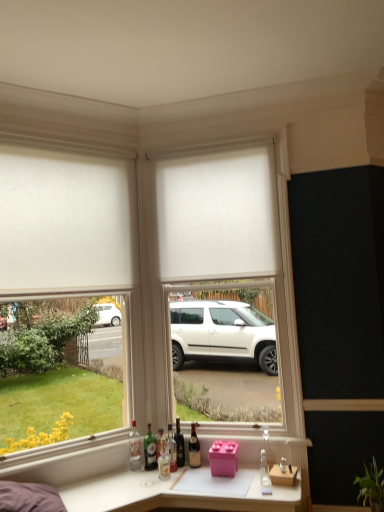
Question: Could you tell me if clear glass bottle at lower left, positioned as the seventh bottle in right-to-left order, is turned towards clear glass bottle at center, which is counted as the first bottle, starting from the right?

Choices:
 (A) yes
 (B) no

Answer: (B)

Question: Can you confirm if clear glass bottle at lower left, which is the 1th bottle from left to right, is bigger than clear glass bottle at center, which is counted as the first bottle, starting from the right?

Choices:
 (A) no
 (B) yes

Answer: (B)

Question: Is clear glass bottle at lower left, which is the 1th bottle from left to right, beside clear glass bottle at center, positioned as the seventh bottle in left-to-right order?

Choices:
 (A) yes
 (B) no

Answer: (B)

Question: Can you confirm if clear glass bottle at lower left, positioned as the seventh bottle in right-to-left order, is thinner than clear glass bottle at center, positioned as the seventh bottle in left-to-right order?

Choices:
 (A) no
 (B) yes

Answer: (A)

Question: Is clear glass bottle at lower left, which is the 1th bottle from left to right, smaller than clear glass bottle at center, which is counted as the first bottle, starting from the right?

Choices:
 (A) no
 (B) yes

Answer: (A)

Question: In terms of size, does translucent glass bottle at center, which ranks as the fourth bottle in left-to-right order, appear bigger or smaller than shiny dark brown bottle at center, the fifth bottle viewed from the left?

Choices:
 (A) big
 (B) small

Answer: (B)

Question: From the image's perspective, relative to shiny dark brown bottle at center, the third bottle from the right, is translucent glass bottle at center, acting as the 4th bottle starting from the right, above or below?

Choices:
 (A) below
 (B) above

Answer: (A)

Question: Visually, is translucent glass bottle at center, which ranks as the fourth bottle in left-to-right order, positioned to the left or to the right of shiny dark brown bottle at center, the fifth bottle viewed from the left?

Choices:
 (A) left
 (B) right

Answer: (A)

Question: Is translucent glass bottle at center, which ranks as the fourth bottle in left-to-right order, situated inside shiny dark brown bottle at center, the third bottle from the right, or outside?

Choices:
 (A) inside
 (B) outside

Answer: (B)

Question: Considering the positions of shiny dark brown bottle at center, the third bottle from the right, and clear glass bottle at center, which is counted as the first bottle, starting from the right, in the image, is shiny dark brown bottle at center, the third bottle from the right, bigger or smaller than clear glass bottle at center, which is counted as the first bottle, starting from the right,?

Choices:
 (A) big
 (B) small

Answer: (A)

Question: From a real-world perspective, relative to clear glass bottle at center, positioned as the seventh bottle in left-to-right order, is shiny dark brown bottle at center, the third bottle from the right, vertically above or below?

Choices:
 (A) above
 (B) below

Answer: (A)

Question: In terms of width, does shiny dark brown bottle at center, the fifth bottle viewed from the left, look wider or thinner when compared to clear glass bottle at center, which is counted as the first bottle, starting from the right?

Choices:
 (A) thin
 (B) wide

Answer: (B)

Question: Considering the positions of shiny dark brown bottle at center, the third bottle from the right, and clear glass bottle at center, which is counted as the first bottle, starting from the right, in the image, is shiny dark brown bottle at center, the third bottle from the right, taller or shorter than clear glass bottle at center, which is counted as the first bottle, starting from the right,?

Choices:
 (A) short
 (B) tall

Answer: (B)

Question: In terms of width, does green glass bottle at lower center, which appears as the second bottle when viewed from the left, look wider or thinner when compared to white matte blind at center?

Choices:
 (A) thin
 (B) wide

Answer: (A)

Question: In terms of height, does green glass bottle at lower center, which appears as the second bottle when viewed from the left, look taller or shorter compared to white matte blind at center?

Choices:
 (A) short
 (B) tall

Answer: (A)